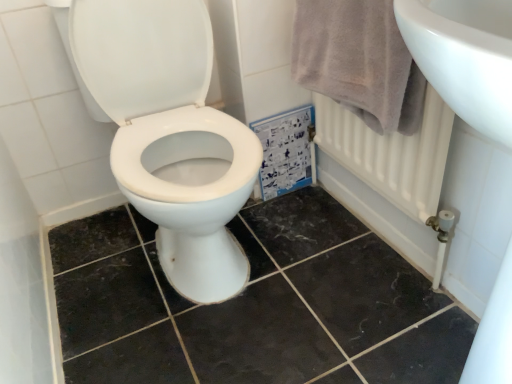
The height and width of the screenshot is (384, 512). Describe the element at coordinates (254, 305) in the screenshot. I see `black marble tile at center` at that location.

At what (x,y) coordinates should I click in order to perform the action: click on light gray cotton towel at upper right. Please return your answer as a coordinate pair (x, y). This screenshot has width=512, height=384. Looking at the image, I should click on (359, 61).

From a real-world perspective, relative to black marble tile at center, is light gray cotton towel at upper right vertically above or below?

light gray cotton towel at upper right is situated higher than black marble tile at center in the real world.

Is light gray cotton towel at upper right positioned with its back to black marble tile at center?

light gray cotton towel at upper right is not turned away from black marble tile at center.

Is light gray cotton towel at upper right in contact with black marble tile at center?

light gray cotton towel at upper right and black marble tile at center are clearly separated.

Is light gray cotton towel at upper right to the right of black marble tile at center from the viewer's perspective?

Correct, you'll find light gray cotton towel at upper right to the right of black marble tile at center.

At what (x,y) coordinates should I click in order to perform the action: click on ceramic tile below the white glossy toilet at center (from the image's perspective). Please return your answer as a coordinate pair (x, y). Image resolution: width=512 pixels, height=384 pixels. Looking at the image, I should click on (254, 305).

Considering the relative positions of black marble tile at center and white glossy toilet at center in the image provided, is black marble tile at center to the left of white glossy toilet at center from the viewer's perspective?

In fact, black marble tile at center is to the right of white glossy toilet at center.

From the image's perspective, which is below, black marble tile at center or white glossy toilet at center?

black marble tile at center, from the image's perspective.

Which of these two, black marble tile at center or white glossy toilet at center, is thinner?

Thinner between the two is white glossy toilet at center.

Would you say light gray cotton towel at upper right is outside white glossy toilet at center?

That's correct, light gray cotton towel at upper right is outside of white glossy toilet at center.

Does point (394, 84) come closer to viewer compared to point (210, 194)?

Yes.

In the scene shown: Which object is further away from the camera, light gray cotton towel at upper right or white glossy toilet at center?

light gray cotton towel at upper right is further from the camera.

Considering the positions of points (218, 142) and (359, 19), is point (218, 142) closer to camera compared to point (359, 19)?

No, (218, 142) is further to viewer.

The image size is (512, 384). In order to click on bath towel above the white glossy toilet at center (from a real-world perspective) in this screenshot , I will do `click(359, 61)`.

Is white glossy toilet at center looking in the opposite direction of light gray cotton towel at upper right?

That's not correct — white glossy toilet at center is not looking away from light gray cotton towel at upper right.

Who is shorter, white glossy toilet at center or black marble tile at center?

Standing shorter between the two is black marble tile at center.

Is white glossy toilet at center directly adjacent to black marble tile at center?

There is a gap between white glossy toilet at center and black marble tile at center.

From a real-world perspective, relative to black marble tile at center, is white glossy toilet at center vertically above or below?

In terms of real-world spatial position, white glossy toilet at center is above black marble tile at center.

Considering the relative sizes of white glossy toilet at center and black marble tile at center in the image provided, is white glossy toilet at center smaller than black marble tile at center?

No.

How much distance is there between black marble tile at center and light gray cotton towel at upper right?

black marble tile at center is 23.07 inches from light gray cotton towel at upper right.

Which is in front, point (429, 372) or point (312, 68)?

The point (429, 372) is in front.

In the scene shown: Could you tell me if black marble tile at center is turned towards light gray cotton towel at upper right?

No, black marble tile at center does not turn towards light gray cotton towel at upper right.

Consider the image. Is black marble tile at center far away from light gray cotton towel at upper right?

No.

What are the coordinates of `ceramic tile below the light gray cotton towel at upper right (from a real-world perspective)` in the screenshot? It's located at (254, 305).

This screenshot has width=512, height=384. Identify the location of toilet on the left side of black marble tile at center. (170, 135).

Which object lies nearer to the anchor point white glossy toilet at center, black marble tile at center or light gray cotton towel at upper right?

Among the two, black marble tile at center is located nearer to white glossy toilet at center.

From the image, which object appears to be farther from light gray cotton towel at upper right, black marble tile at center or white glossy toilet at center?

Among the two, black marble tile at center is located further to light gray cotton towel at upper right.

Looking at the image, which one is located closer to white glossy toilet at center, light gray cotton towel at upper right or black marble tile at center?

black marble tile at center lies closer to white glossy toilet at center than the other object.

When comparing their distances from light gray cotton towel at upper right, does white glossy toilet at center or black marble tile at center seem further?

black marble tile at center is further to light gray cotton towel at upper right.

Considering their positions, is white glossy toilet at center positioned closer to black marble tile at center than light gray cotton towel at upper right?

white glossy toilet at center is positioned closer to the anchor black marble tile at center.

From the image, which object appears to be farther from black marble tile at center, light gray cotton towel at upper right or white glossy toilet at center?

The object further to black marble tile at center is light gray cotton towel at upper right.

Where is `toilet between light gray cotton towel at upper right and black marble tile at center in the up-down direction`? toilet between light gray cotton towel at upper right and black marble tile at center in the up-down direction is located at coordinates (170, 135).